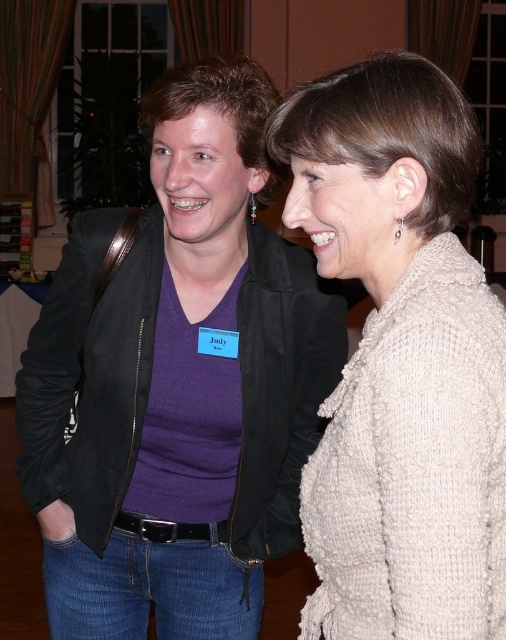
Can you confirm if knitted beige sweater at right is taller than knitted beige sweater at center?

Yes.

In order to click on knitted beige sweater at right in this screenshot , I will do click(400, 358).